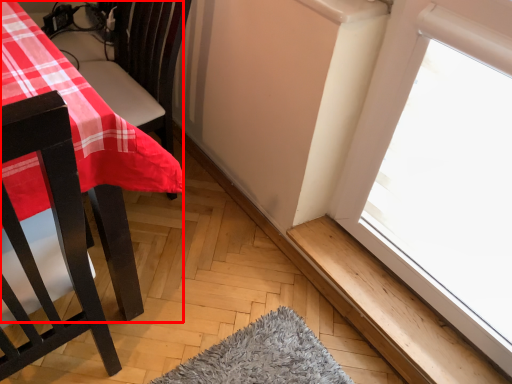
Question: Where is table (annotated by the red box) located in relation to window sill in the image?

Choices:
 (A) right
 (B) left

Answer: (B)